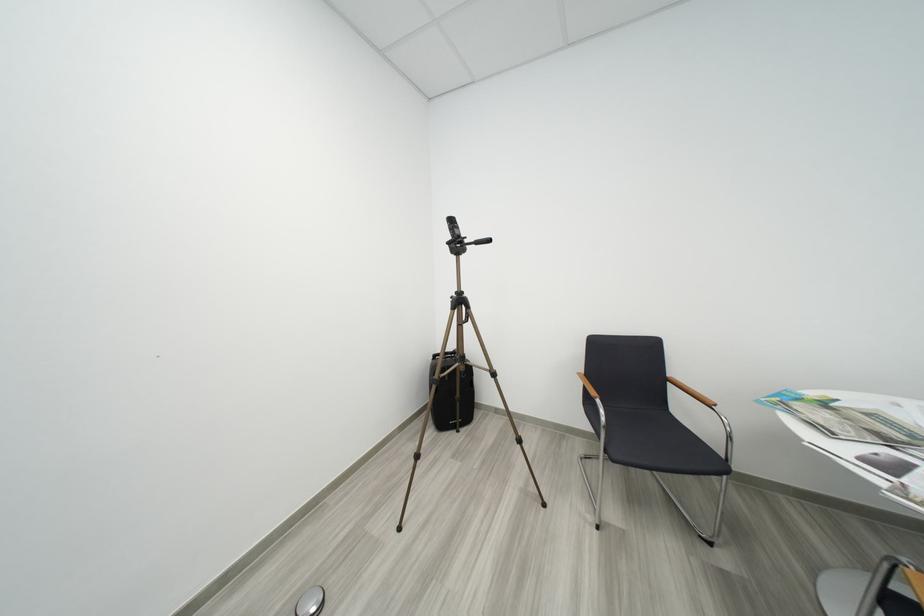
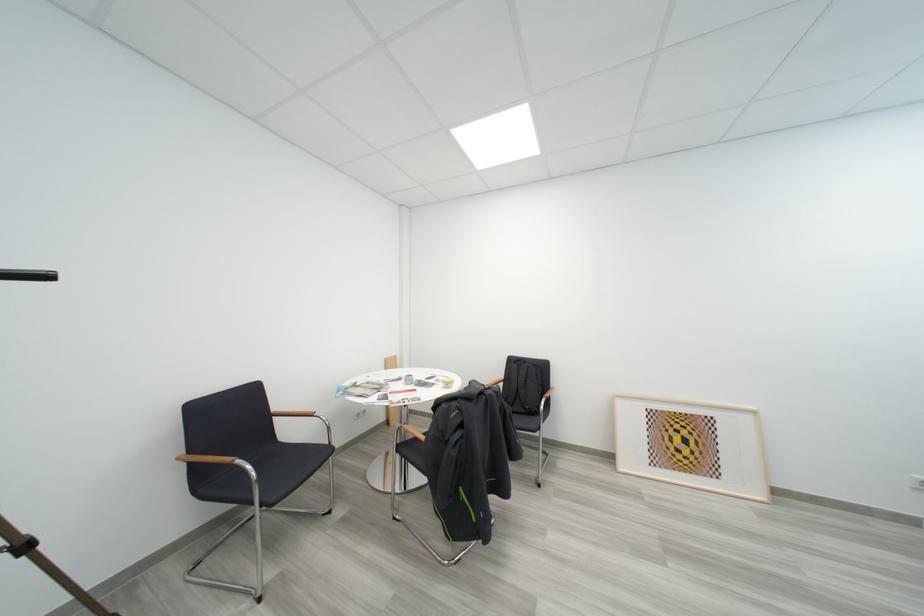
The point at (608, 403) is marked in the first image. Where is the corresponding point in the second image?

(247, 464)